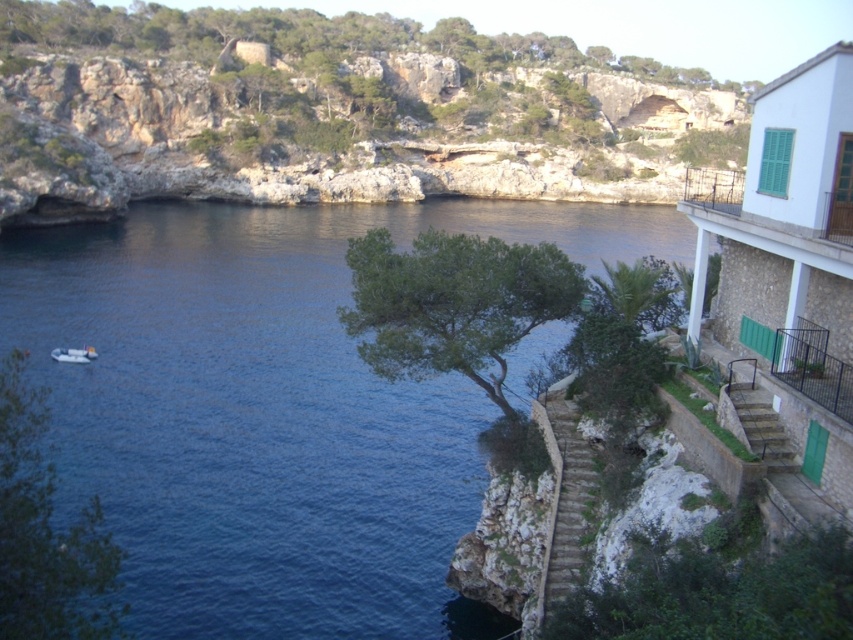
You are a bird looking for a place to perch. You see two trees in the scene, the green leafy tree at center and the green leafy tree at lower right. Which tree is taller?

The green leafy tree at center is taller than the green leafy tree at lower right.

You are standing at the bottom of the staircase on the rocky cliffside and want to reach the green leafy tree at lower right. Which direction should you head towards?

The green leafy tree at lower right is located at point (718, 595), so you should head towards the lower right direction from your current position at the bottom of the staircase.